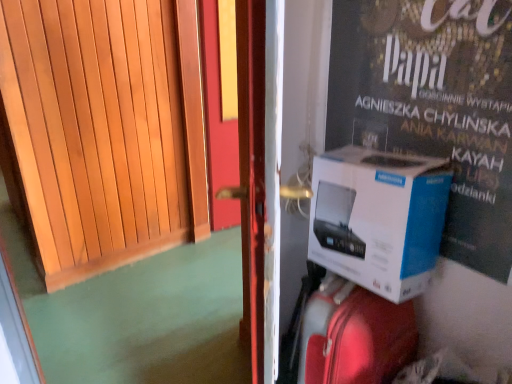
Question: From a real-world perspective, is white cardboard box at right on top of wooden door at left?

Choices:
 (A) no
 (B) yes

Answer: (B)

Question: Is white cardboard box at right at the left side of wooden door at left?

Choices:
 (A) yes
 (B) no

Answer: (B)

Question: From the image's perspective, is white cardboard box at right above wooden door at left?

Choices:
 (A) yes
 (B) no

Answer: (A)

Question: Considering the relative positions of white cardboard box at right and wooden door at left in the image provided, is white cardboard box at right to the right of wooden door at left from the viewer's perspective?

Choices:
 (A) no
 (B) yes

Answer: (B)

Question: Is wooden door at left located within white cardboard box at right?

Choices:
 (A) no
 (B) yes

Answer: (A)

Question: Is white cardboard box at right closer to the viewer compared to wooden door at left?

Choices:
 (A) no
 (B) yes

Answer: (A)

Question: Does shiny red suitcase at center have a lesser width compared to white cardboard box at right?

Choices:
 (A) no
 (B) yes

Answer: (A)

Question: From a real-world perspective, is shiny red suitcase at center below white cardboard box at right?

Choices:
 (A) no
 (B) yes

Answer: (B)

Question: Can you confirm if shiny red suitcase at center is smaller than white cardboard box at right?

Choices:
 (A) no
 (B) yes

Answer: (A)

Question: Can you confirm if shiny red suitcase at center is positioned to the right of white cardboard box at right?

Choices:
 (A) yes
 (B) no

Answer: (B)

Question: Are shiny red suitcase at center and white cardboard box at right making contact?

Choices:
 (A) no
 (B) yes

Answer: (A)

Question: Can you confirm if shiny red suitcase at center is taller than white cardboard box at right?

Choices:
 (A) yes
 (B) no

Answer: (A)

Question: Is shiny red suitcase at center beside white cardboard box at right?

Choices:
 (A) yes
 (B) no

Answer: (B)